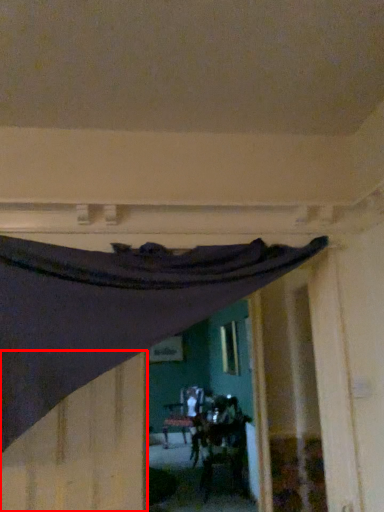
Question: Where is plywood (annotated by the red box) located in relation to curtain in the image?

Choices:
 (A) right
 (B) left

Answer: (B)